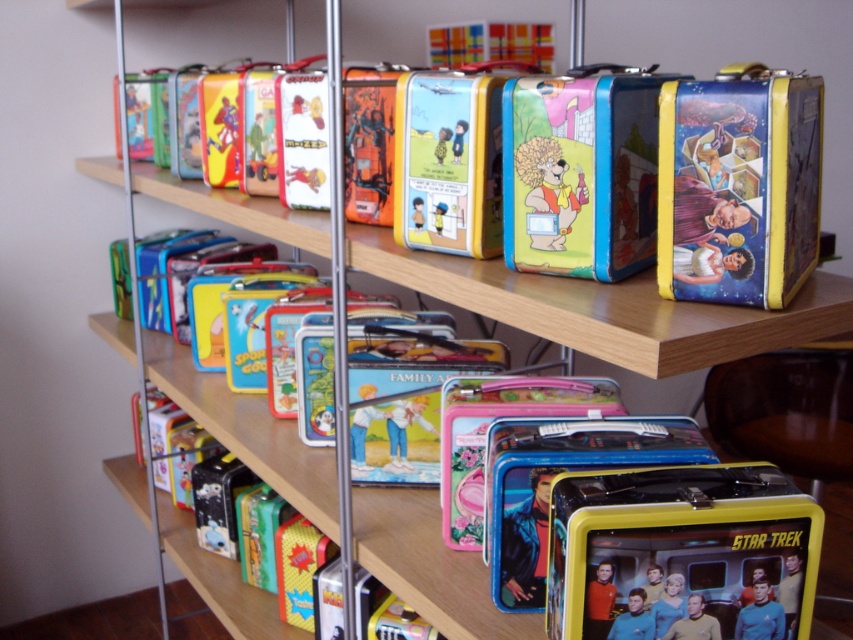
Can you confirm if metallic yellow lunchbox at lower right is positioned below metallic yellow lunchbox at right?

Indeed, metallic yellow lunchbox at lower right is positioned under metallic yellow lunchbox at right.

Is metallic yellow lunchbox at lower right thinner than metallic yellow lunchbox at right?

No, metallic yellow lunchbox at lower right is not thinner than metallic yellow lunchbox at right.

Identify the location of metallic yellow lunchbox at lower right. (680, 548).